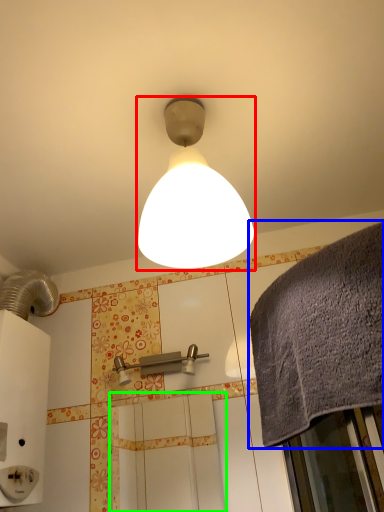
Question: Which object is positioned closest to lamp (highlighted by a red box)? Select from bath towel (highlighted by a blue box) and screen door (highlighted by a green box).

Choices:
 (A) bath towel
 (B) screen door

Answer: (A)